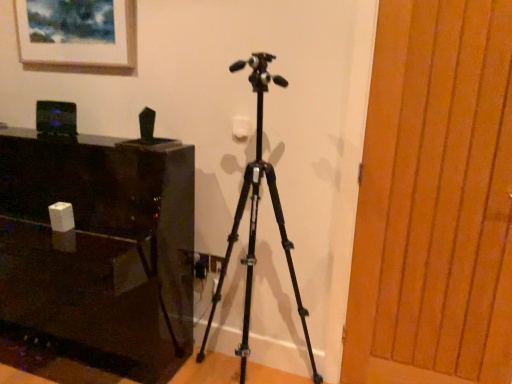
Question: Is matte wooden picture frame at upper left shorter than glossy black table at left?

Choices:
 (A) no
 (B) yes

Answer: (B)

Question: From a real-world perspective, does matte wooden picture frame at upper left stand above glossy black table at left?

Choices:
 (A) no
 (B) yes

Answer: (B)

Question: From a real-world perspective, does matte wooden picture frame at upper left sit lower than glossy black table at left?

Choices:
 (A) no
 (B) yes

Answer: (A)

Question: Is glossy black table at left a part of matte wooden picture frame at upper left?

Choices:
 (A) no
 (B) yes

Answer: (A)

Question: Could you tell me if matte wooden picture frame at upper left is turned towards glossy black table at left?

Choices:
 (A) yes
 (B) no

Answer: (B)

Question: Considering the positions of wooden door at right and matte wooden picture frame at upper left in the image, is wooden door at right wider or thinner than matte wooden picture frame at upper left?

Choices:
 (A) wide
 (B) thin

Answer: (B)

Question: Is wooden door at right taller or shorter than matte wooden picture frame at upper left?

Choices:
 (A) short
 (B) tall

Answer: (B)

Question: Considering the relative positions of wooden door at right and matte wooden picture frame at upper left in the image provided, is wooden door at right to the left or to the right of matte wooden picture frame at upper left?

Choices:
 (A) right
 (B) left

Answer: (A)

Question: From a real-world perspective, is wooden door at right above or below matte wooden picture frame at upper left?

Choices:
 (A) below
 (B) above

Answer: (A)

Question: Is point (106, 208) closer or farther from the camera than point (288, 266)?

Choices:
 (A) closer
 (B) farther

Answer: (A)

Question: In the image, is glossy black table at left positioned in front of or behind black matte tripod at center?

Choices:
 (A) front
 (B) behind

Answer: (B)

Question: Do you think glossy black table at left is within black matte tripod at center, or outside of it?

Choices:
 (A) outside
 (B) inside

Answer: (A)

Question: In terms of height, does glossy black table at left look taller or shorter compared to black matte tripod at center?

Choices:
 (A) tall
 (B) short

Answer: (B)

Question: In terms of height, does black matte tripod at center look taller or shorter compared to glossy black table at left?

Choices:
 (A) short
 (B) tall

Answer: (B)

Question: From a real-world perspective, relative to glossy black table at left, is black matte tripod at center vertically above or below?

Choices:
 (A) below
 (B) above

Answer: (B)